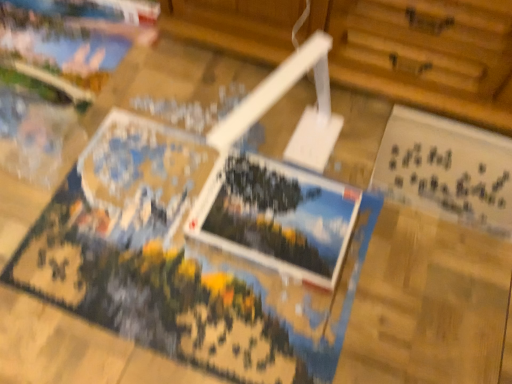
Describe the element at coordinates (447, 169) in the screenshot. This screenshot has width=512, height=384. I see `white paper postcard at lower right, the 2th postcard from the left` at that location.

Locate an element on the screen. white paper postcard at lower right, the 1th postcard in the right-to-left sequence is located at coordinates (447, 169).

Find the location of a particular element. The height and width of the screenshot is (384, 512). printed paper postcard at center, which ranks as the 2th postcard in right-to-left order is located at coordinates coord(276,216).

The height and width of the screenshot is (384, 512). What do you see at coordinates (276, 216) in the screenshot?
I see `printed paper postcard at center, which ranks as the 2th postcard in right-to-left order` at bounding box center [276, 216].

Consider the image. What is the approximate height of printed paper postcard at center, which ranks as the 2th postcard in right-to-left order?

printed paper postcard at center, which ranks as the 2th postcard in right-to-left order, is 2.15 inches in height.

I want to click on white paper postcard at lower right, the 1th postcard in the right-to-left sequence, so click(x=447, y=169).

In the scene shown: Can you confirm if printed paper postcard at center, which ranks as the 2th postcard in right-to-left order, is positioned to the left of white paper postcard at lower right, the 1th postcard in the right-to-left sequence?

Indeed, printed paper postcard at center, which ranks as the 2th postcard in right-to-left order, is positioned on the left side of white paper postcard at lower right, the 1th postcard in the right-to-left sequence.

Which is in front, printed paper postcard at center, positioned as the first postcard in left-to-right order, or white paper postcard at lower right, the 2th postcard from the left?

printed paper postcard at center, positioned as the first postcard in left-to-right order.

Is point (297, 231) closer to camera compared to point (505, 173)?

Yes, it is in front of point (505, 173).

From the image's perspective, which is below, printed paper postcard at center, positioned as the first postcard in left-to-right order, or white paper postcard at lower right, the 2th postcard from the left?

From the image's view, printed paper postcard at center, positioned as the first postcard in left-to-right order, is below.

Looking at this image, from a real-world perspective, which is physically above, printed paper postcard at center, positioned as the first postcard in left-to-right order, or white paper postcard at lower right, the 2th postcard from the left?

In real-world perspective, printed paper postcard at center, positioned as the first postcard in left-to-right order, is above.

Can you confirm if printed paper postcard at center, positioned as the first postcard in left-to-right order, is wider than white paper postcard at lower right, the 2th postcard from the left?

In fact, printed paper postcard at center, positioned as the first postcard in left-to-right order, might be narrower than white paper postcard at lower right, the 2th postcard from the left.

Does printed paper postcard at center, which ranks as the 2th postcard in right-to-left order, have a greater height compared to white paper postcard at lower right, the 2th postcard from the left?

In fact, printed paper postcard at center, which ranks as the 2th postcard in right-to-left order, may be shorter than white paper postcard at lower right, the 2th postcard from the left.

Based on their sizes in the image, would you say printed paper postcard at center, positioned as the first postcard in left-to-right order, is bigger or smaller than white paper postcard at lower right, the 1th postcard in the right-to-left sequence?

Clearly, printed paper postcard at center, positioned as the first postcard in left-to-right order, is smaller in size than white paper postcard at lower right, the 1th postcard in the right-to-left sequence.

Based on the photo, is white paper postcard at lower right, the 1th postcard in the right-to-left sequence, completely or partially inside printed paper postcard at center, which ranks as the 2th postcard in right-to-left order?

No, white paper postcard at lower right, the 1th postcard in the right-to-left sequence, is not a part of printed paper postcard at center, which ranks as the 2th postcard in right-to-left order.

Is printed paper postcard at center, positioned as the first postcard in left-to-right order, in contact with white paper postcard at lower right, the 2th postcard from the left?

There is a gap between printed paper postcard at center, positioned as the first postcard in left-to-right order, and white paper postcard at lower right, the 2th postcard from the left.

Does printed paper postcard at center, which ranks as the 2th postcard in right-to-left order, turn towards white paper postcard at lower right, the 2th postcard from the left?

No, printed paper postcard at center, which ranks as the 2th postcard in right-to-left order, is not oriented towards white paper postcard at lower right, the 2th postcard from the left.

In order to click on postcard on the left of the white paper postcard at lower right, the 1th postcard in the right-to-left sequence in this screenshot , I will do `click(276, 216)`.

Would you say white paper postcard at lower right, the 1th postcard in the right-to-left sequence, is to the left or to the right of printed paper postcard at center, positioned as the first postcard in left-to-right order, in the picture?

white paper postcard at lower right, the 1th postcard in the right-to-left sequence, is positioned on printed paper postcard at center, positioned as the first postcard in left-to-right order,'s right side.

Considering their positions, is white paper postcard at lower right, the 2th postcard from the left, located in front of or behind printed paper postcard at center, which ranks as the 2th postcard in right-to-left order?

In the image, white paper postcard at lower right, the 2th postcard from the left, appears behind printed paper postcard at center, which ranks as the 2th postcard in right-to-left order.

Which is behind, point (452, 176) or point (341, 263)?

The point (452, 176) is more distant.

From the image's perspective, which one is positioned lower, white paper postcard at lower right, the 2th postcard from the left, or printed paper postcard at center, which ranks as the 2th postcard in right-to-left order?

printed paper postcard at center, which ranks as the 2th postcard in right-to-left order, appears lower in the image.

From a real-world perspective, relative to printed paper postcard at center, positioned as the first postcard in left-to-right order, is white paper postcard at lower right, the 2th postcard from the left, vertically above or below?

From a real-world perspective, white paper postcard at lower right, the 2th postcard from the left, is physically below printed paper postcard at center, positioned as the first postcard in left-to-right order.

Does white paper postcard at lower right, the 1th postcard in the right-to-left sequence, have a greater width compared to printed paper postcard at center, positioned as the first postcard in left-to-right order?

Correct, the width of white paper postcard at lower right, the 1th postcard in the right-to-left sequence, exceeds that of printed paper postcard at center, positioned as the first postcard in left-to-right order.

Is white paper postcard at lower right, the 2th postcard from the left, taller than printed paper postcard at center, which ranks as the 2th postcard in right-to-left order?

Yes, white paper postcard at lower right, the 2th postcard from the left, is taller than printed paper postcard at center, which ranks as the 2th postcard in right-to-left order.

Can you confirm if white paper postcard at lower right, the 1th postcard in the right-to-left sequence, is bigger than printed paper postcard at center, which ranks as the 2th postcard in right-to-left order?

Correct, white paper postcard at lower right, the 1th postcard in the right-to-left sequence, is larger in size than printed paper postcard at center, which ranks as the 2th postcard in right-to-left order.

Would you say white paper postcard at lower right, the 1th postcard in the right-to-left sequence, is outside printed paper postcard at center, positioned as the first postcard in left-to-right order?

white paper postcard at lower right, the 1th postcard in the right-to-left sequence, is positioned outside printed paper postcard at center, positioned as the first postcard in left-to-right order.

Looking at this image, is the surface of white paper postcard at lower right, the 1th postcard in the right-to-left sequence, in direct contact with printed paper postcard at center, positioned as the first postcard in left-to-right order?

No, white paper postcard at lower right, the 1th postcard in the right-to-left sequence, is not in contact with printed paper postcard at center, positioned as the first postcard in left-to-right order.

Could you tell me if white paper postcard at lower right, the 2th postcard from the left, is turned towards printed paper postcard at center, which ranks as the 2th postcard in right-to-left order?

No, white paper postcard at lower right, the 2th postcard from the left, is not aimed at printed paper postcard at center, which ranks as the 2th postcard in right-to-left order.

Find the location of `postcard behind the printed paper postcard at center, positioned as the first postcard in left-to-right order`. postcard behind the printed paper postcard at center, positioned as the first postcard in left-to-right order is located at coordinates (447, 169).

Locate an element on the screen. The height and width of the screenshot is (384, 512). postcard located in front of the white paper postcard at lower right, the 1th postcard in the right-to-left sequence is located at coordinates (276, 216).

The width and height of the screenshot is (512, 384). Find the location of `postcard on the right side of printed paper postcard at center, positioned as the first postcard in left-to-right order`. postcard on the right side of printed paper postcard at center, positioned as the first postcard in left-to-right order is located at coordinates (447, 169).